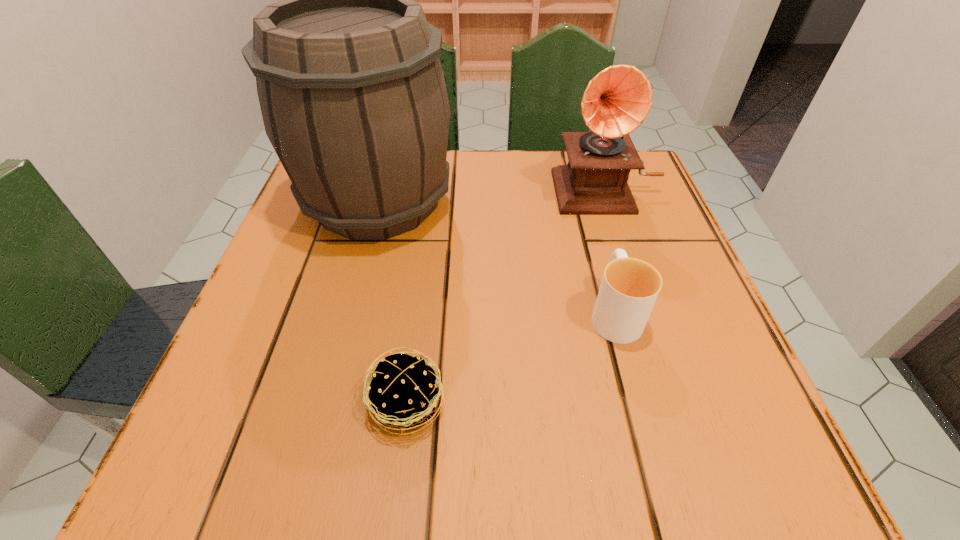
You are a GUI agent. You are given a task and a screenshot of the screen. Output one action in this format:
    pyautogui.click(x=<x>, y=<y>)
    Task: Click on the vacant space located with the handle on the side of the cup
    Image resolution: width=960 pixels, height=540 pixels.
    Given the screenshot: What is the action you would take?
    pyautogui.click(x=583, y=196)

Locate an element on the screen. The height and width of the screenshot is (540, 960). free space located on the back of the nearest object is located at coordinates (421, 292).

This screenshot has width=960, height=540. In order to click on wine bucket located at the far edge in this screenshot , I will do `click(352, 92)`.

At what (x,y) coordinates should I click in order to perform the action: click on phonograph record that is at the far edge. Please return your answer as a coordinate pair (x, y). Looking at the image, I should click on (617, 100).

The image size is (960, 540). What are the coordinates of `object present at the near edge` in the screenshot? It's located at (403, 394).

This screenshot has height=540, width=960. Identify the location of object that is at the left edge. coord(352,92).

At what (x,y) coordinates should I click in order to perform the action: click on phonograph record that is at the right edge. Please return your answer as a coordinate pair (x, y). Looking at the image, I should click on (617, 100).

Where is `cup present at the right edge`? cup present at the right edge is located at coordinates (629, 288).

Identify the location of object present at the far left corner. The image size is (960, 540). point(352,92).

Locate an element on the screen. The height and width of the screenshot is (540, 960). object present at the far right corner is located at coordinates (617, 100).